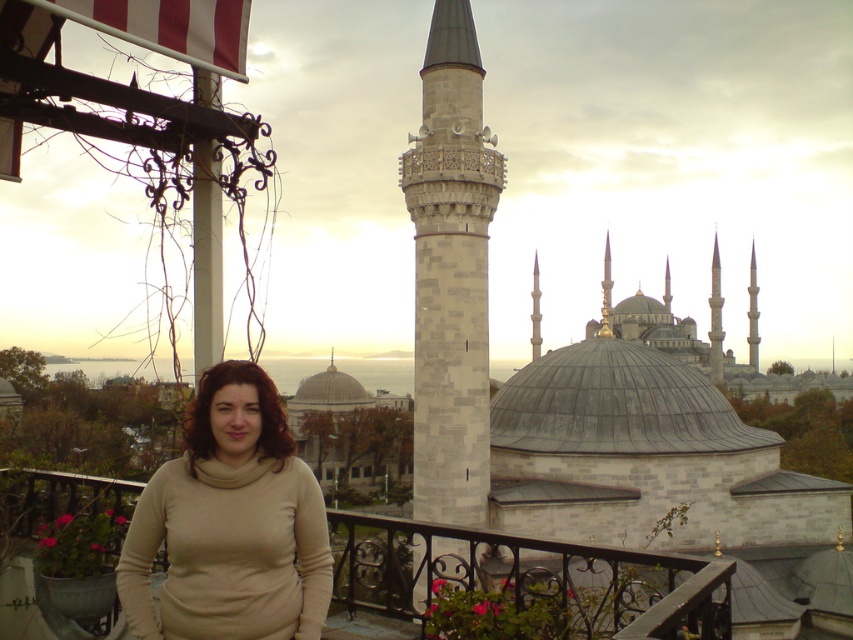
Question: Can you confirm if beige turtleneck sweater at center is positioned to the right of white marble minaret at center?

Choices:
 (A) no
 (B) yes

Answer: (A)

Question: Which of the following is the closest to the observer?

Choices:
 (A) (467, 100)
 (B) (709, 604)
 (C) (163, 636)

Answer: (B)

Question: Based on their relative distances, which object is farther from the black wrought iron railing at lower center?

Choices:
 (A) beige turtleneck sweater at center
 (B) metallic wrought iron at left

Answer: (B)

Question: Based on their relative distances, which object is nearer to the black wrought iron railing at lower center?

Choices:
 (A) beige turtleneck sweater at center
 (B) white marble minaret at center

Answer: (B)

Question: Can you confirm if beige turtleneck sweater at center is positioned below metallic wrought iron at left?

Choices:
 (A) yes
 (B) no

Answer: (A)

Question: Can you confirm if black wrought iron railing at lower center is bigger than metallic wrought iron at left?

Choices:
 (A) yes
 (B) no

Answer: (A)